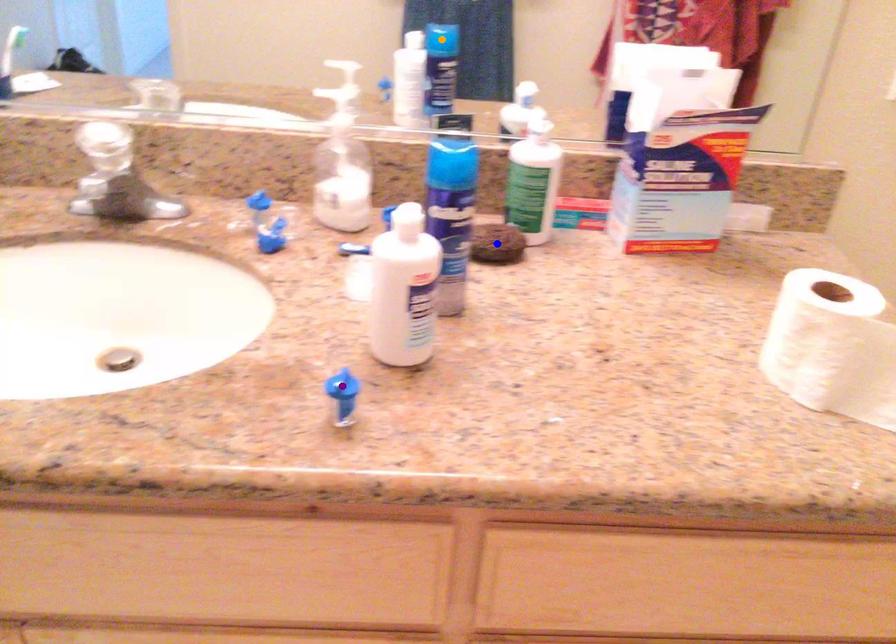
Order these from farthest to nearest:
- blue point
- purple point
- orange point

1. orange point
2. blue point
3. purple point